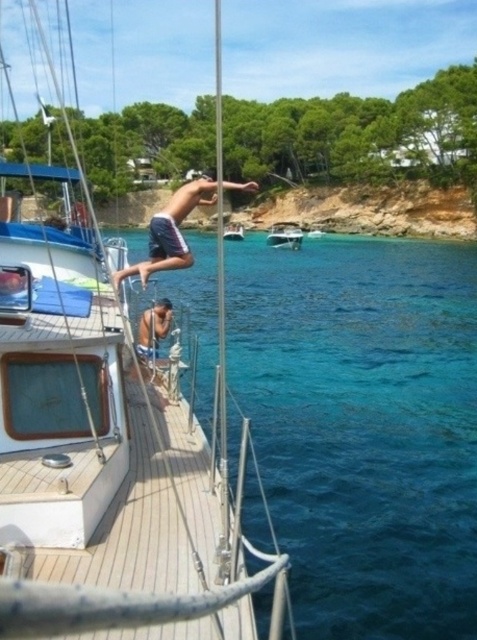
Question: Where is wooden sailboat at left located in relation to wooden sailboat at center in the image?

Choices:
 (A) left
 (B) right

Answer: (A)

Question: Does wooden sailboat at left appear over wooden sailboat at center?

Choices:
 (A) no
 (B) yes

Answer: (B)

Question: Which of these objects is positioned farthest from the dark blue shorts at center?

Choices:
 (A) wooden sailboat at center
 (B) white glossy boat at center
 (C) clear blue water at center

Answer: (A)

Question: Which object is closer to the camera taking this photo?

Choices:
 (A) wooden sailboat at left
 (B) wooden sailboat at center
 (C) dark blue shorts at center

Answer: (A)

Question: Can you confirm if wooden sailboat at left is positioned above dark blue shorts at center?

Choices:
 (A) no
 (B) yes

Answer: (B)

Question: Which of the following is the farthest from the observer?

Choices:
 (A) wooden sailboat at center
 (B) dark blue shorts at center

Answer: (A)